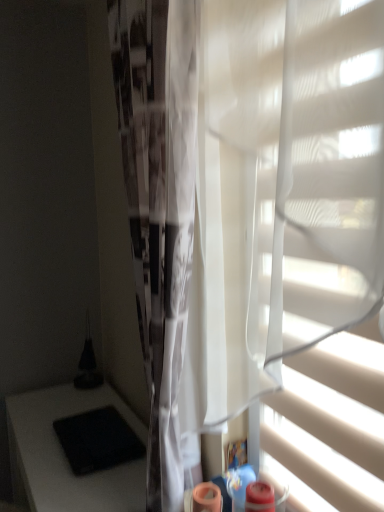
The height and width of the screenshot is (512, 384). I want to click on free space in front of black matte pad at lower left, so click(x=85, y=485).